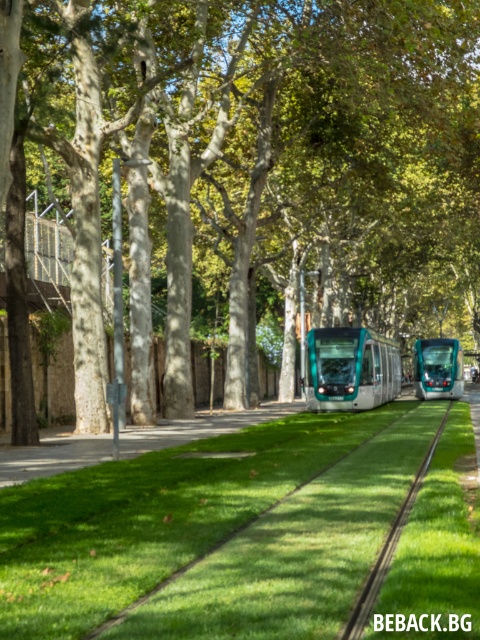
Is point (83, 368) farther from viewer compared to point (441, 376)?

No, (83, 368) is closer to viewer.

Which is more to the right, green leafy tree at center or teal glossy tram at center?

teal glossy tram at center

Between point (304, 152) and point (463, 385), which one is positioned in front?

Positioned in front is point (304, 152).

Image resolution: width=480 pixels, height=640 pixels. Identify the location of green leafy tree at center. (264, 164).

Can you confirm if teal glass train at center is smaller than teal glossy tram at center?

Incorrect, teal glass train at center is not smaller in size than teal glossy tram at center.

Does teal glass train at center appear under teal glossy tram at center?

Yes.

Is point (392, 349) farther from viewer compared to point (463, 381)?

No, (392, 349) is in front of (463, 381).

Where is `teal glass train at center`? teal glass train at center is located at coordinates (350, 369).

Is green leafy tree at center further to camera compared to teal glass train at center?

No, green leafy tree at center is in front of teal glass train at center.

Does green leafy tree at center appear under teal glass train at center?

Incorrect, green leafy tree at center is not positioned below teal glass train at center.

At what (x,y) coordinates should I click in order to perform the action: click on green leafy tree at center. Please return your answer as a coordinate pair (x, y). The image size is (480, 640). Looking at the image, I should click on (264, 164).